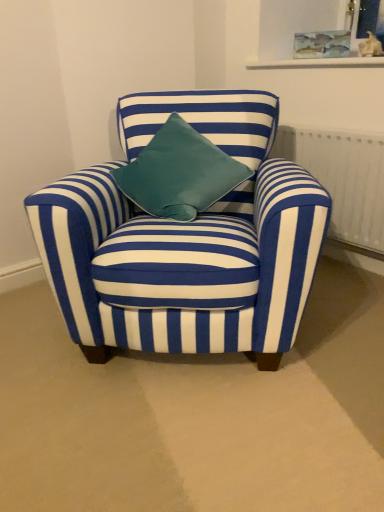
Question: From the image's perspective, is watercolor paper picture frame at upper center positioned above or below white textured radiator at right?

Choices:
 (A) below
 (B) above

Answer: (B)

Question: Relative to white textured radiator at right, is watercolor paper picture frame at upper center in front or behind?

Choices:
 (A) behind
 (B) front

Answer: (A)

Question: Estimate the real-world distances between objects in this image. Which object is closer to the watercolor paper picture frame at upper center?

Choices:
 (A) white textured radiator at right
 (B) blue striped fabric chair at center

Answer: (A)

Question: Based on their relative distances, which object is farther from the white textured radiator at right?

Choices:
 (A) watercolor paper picture frame at upper center
 (B) blue striped fabric chair at center

Answer: (B)